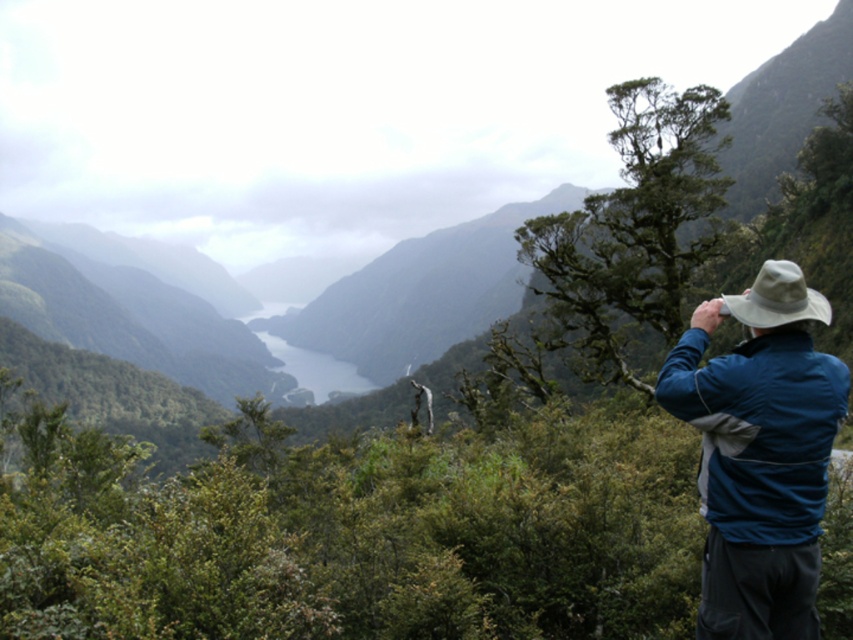
Who is taller, blue fabric jacket at right or gray/smooth lake at center?

gray/smooth lake at center

Is blue fabric jacket at right smaller than gray/smooth lake at center?

Yes, blue fabric jacket at right is smaller than gray/smooth lake at center.

Which is in front, point (770, 618) or point (316, 374)?

Point (770, 618)

The image size is (853, 640). I want to click on blue fabric jacket at right, so click(x=759, y=452).

Who is more distant from viewer, (469, 449) or (730, 310)?

The point (469, 449) is more distant.

Which is in front, point (404, 621) or point (714, 376)?

Point (714, 376) is more forward.

Find the location of a particular element. This screenshot has height=640, width=853. green leafy shrubs at center is located at coordinates (349, 531).

Is green leafy shrubs at center behind gray/smooth lake at center?

That is False.

Does green leafy shrubs at center have a greater width compared to gray/smooth lake at center?

No.

Describe the element at coordinates (349, 531) in the screenshot. I see `green leafy shrubs at center` at that location.

The width and height of the screenshot is (853, 640). In order to click on green leafy shrubs at center in this screenshot , I will do `click(349, 531)`.